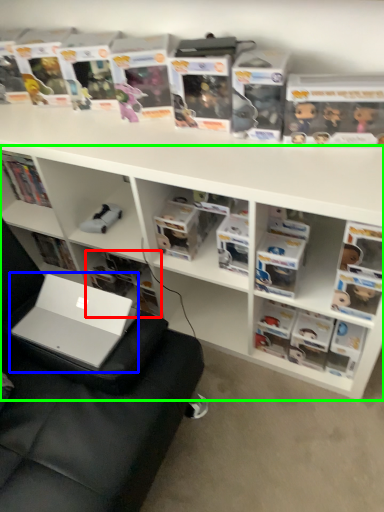
Question: Based on their relative distances, which object is nearer to book (highlighted by a red box)? Choose from laptop (highlighted by a blue box) and bookshelf (highlighted by a green box).

Choices:
 (A) laptop
 (B) bookshelf

Answer: (B)